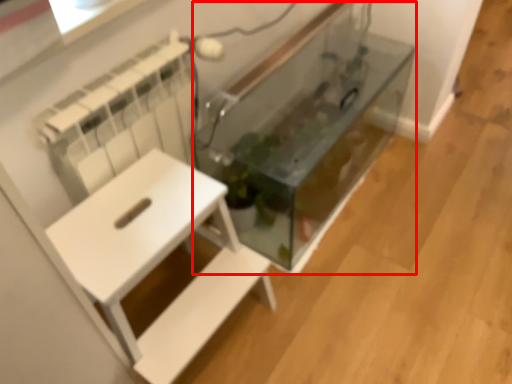
Question: Where is glass box (annotated by the red box) located in relation to furniture in the image?

Choices:
 (A) left
 (B) right

Answer: (B)